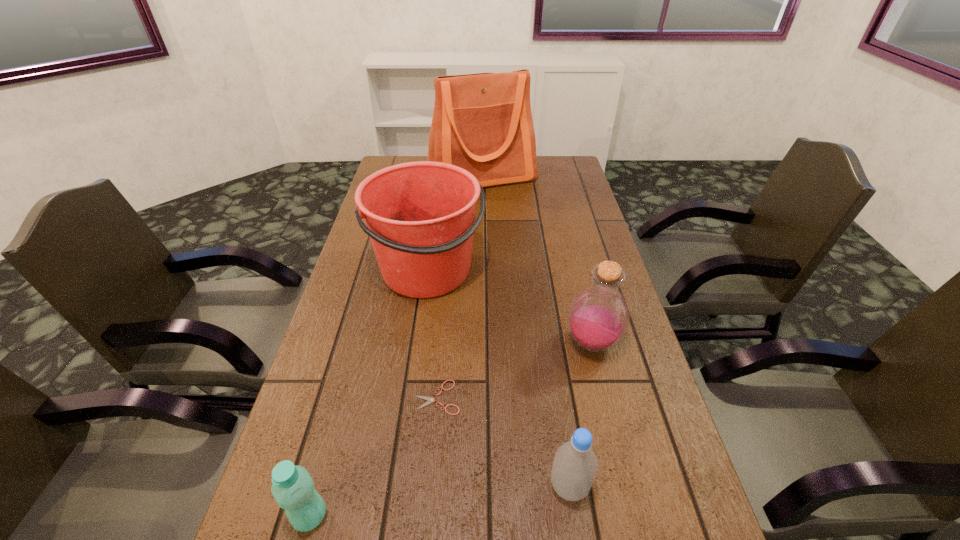
The width and height of the screenshot is (960, 540). What are the coordinates of `free space located on the right of the bucket` in the screenshot? It's located at (611, 271).

This screenshot has width=960, height=540. Find the location of `free spot located on the back of the farthest bottle`. free spot located on the back of the farthest bottle is located at coordinates (572, 265).

The image size is (960, 540). Identify the location of vacant region located on the left of the second bottle from left to right. (456, 487).

In order to click on vacant region located 0.090m on the right of the leftmost bottle in this screenshot , I will do `click(380, 516)`.

The height and width of the screenshot is (540, 960). What are the coordinates of `vacant region located on the right of the shortest object` in the screenshot? It's located at (605, 397).

You are a GUI agent. You are given a task and a screenshot of the screen. Output one action in this format:
    pyautogui.click(x=<x>, y=<y>)
    Task: Click on the object that is at the far edge
    
    Given the screenshot: What is the action you would take?
    pyautogui.click(x=482, y=122)

Find the location of `bucket that is at the left edge`. bucket that is at the left edge is located at coordinates (420, 216).

This screenshot has width=960, height=540. Identify the location of bottle situated at the left edge. (293, 489).

You are a GUI agent. You are given a task and a screenshot of the screen. Output one action in this format:
    pyautogui.click(x=<x>, y=<y>)
    Task: Click on the shopping bag that is at the right edge
    The image size is (960, 540).
    Given the screenshot: What is the action you would take?
    pyautogui.click(x=482, y=122)

Where is `bottle that is at the right edge`? The height and width of the screenshot is (540, 960). bottle that is at the right edge is located at coordinates (598, 317).